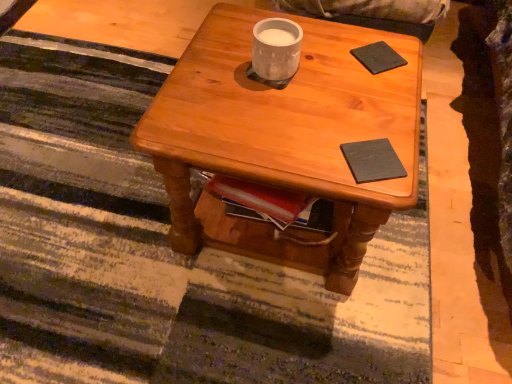
At what (x,y) coordinates should I click in order to perform the action: click on vacant space that is in between white matte cup at center and dark matte book at center, which is the first pad from front to back. Please return your answer as a coordinate pair (x, y). Looking at the image, I should click on (318, 114).